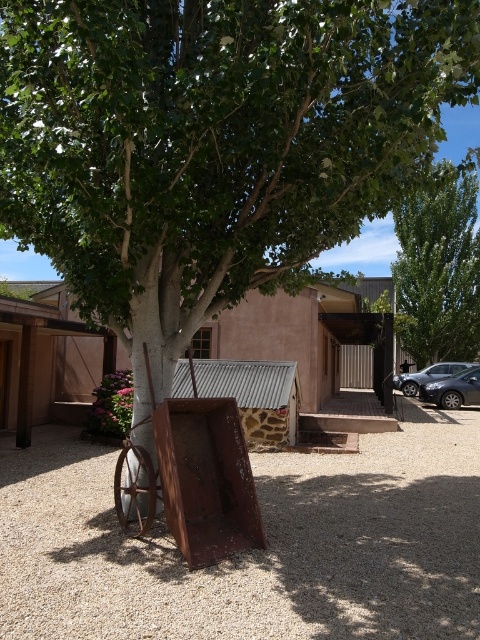
Question: Is satin black sedan at lower right behind shiny metallic car at lower right?

Choices:
 (A) no
 (B) yes

Answer: (B)

Question: Which of the following is the closest to the observer?

Choices:
 (A) shiny metallic car at lower right
 (B) rusty metal wagon at center

Answer: (B)

Question: Is rusty metal wagon at center above shiny metallic car at lower right?

Choices:
 (A) no
 (B) yes

Answer: (B)

Question: Based on their relative distances, which object is farther from the shiny metallic car at lower right?

Choices:
 (A) satin black sedan at lower right
 (B) green leafy tree at upper right
 (C) rustic wood cart at center
 (D) rusty metal wagon at center

Answer: (D)

Question: Which of these objects is positioned closest to the shiny metallic car at lower right?

Choices:
 (A) rustic wood cart at center
 (B) satin black sedan at lower right
 (C) green leafy tree at upper right

Answer: (B)

Question: Does rusty metal wagon at center have a larger size compared to shiny metallic car at lower right?

Choices:
 (A) yes
 (B) no

Answer: (B)